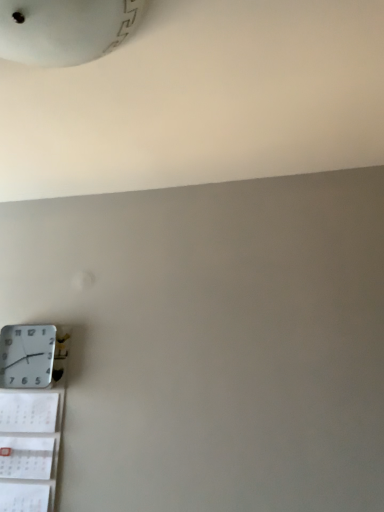
Question: Considering the positions of point (3, 339) and point (34, 476), is point (3, 339) closer or farther from the camera than point (34, 476)?

Choices:
 (A) closer
 (B) farther

Answer: (B)

Question: In terms of width, does white plastic wall clock at lower left look wider or thinner when compared to white paper calendar at lower left?

Choices:
 (A) thin
 (B) wide

Answer: (B)

Question: From the image's perspective, is white plastic wall clock at lower left positioned above or below white paper calendar at lower left?

Choices:
 (A) above
 (B) below

Answer: (A)

Question: Based on their sizes in the image, would you say white paper calendar at lower left is bigger or smaller than white plastic wall clock at lower left?

Choices:
 (A) big
 (B) small

Answer: (A)

Question: Would you say white paper calendar at lower left is to the left or to the right of white plastic wall clock at lower left in the picture?

Choices:
 (A) right
 (B) left

Answer: (A)

Question: Is white paper calendar at lower left wider or thinner than white plastic wall clock at lower left?

Choices:
 (A) wide
 (B) thin

Answer: (B)

Question: Choose the correct answer: Is white paper calendar at lower left inside white plastic wall clock at lower left or outside it?

Choices:
 (A) outside
 (B) inside

Answer: (A)